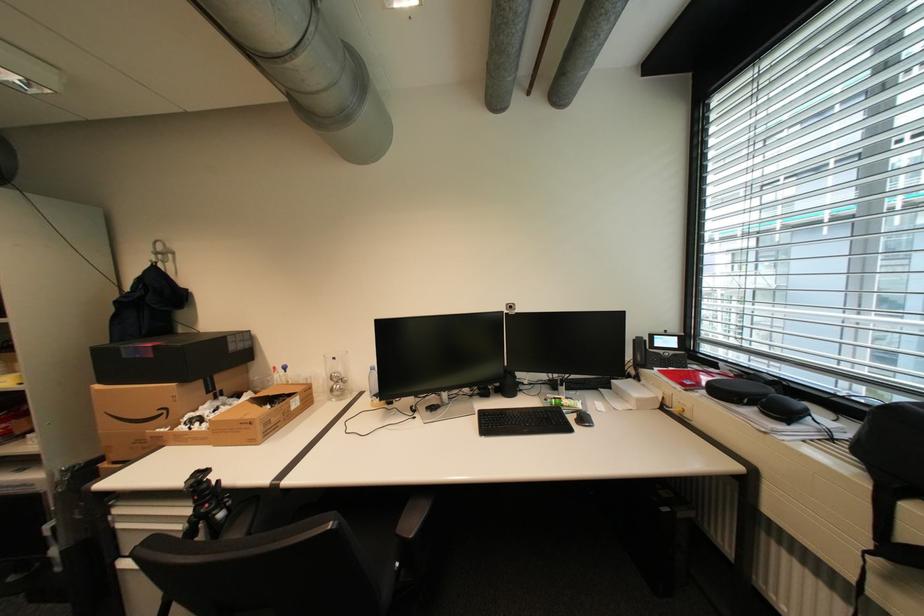
At what (x,y) coordinates should I click in order to perform the action: click on recessed drawer pull. Please return your answer as a coordinate pair (x, y). This screenshot has height=616, width=924. Looking at the image, I should click on (725, 414).